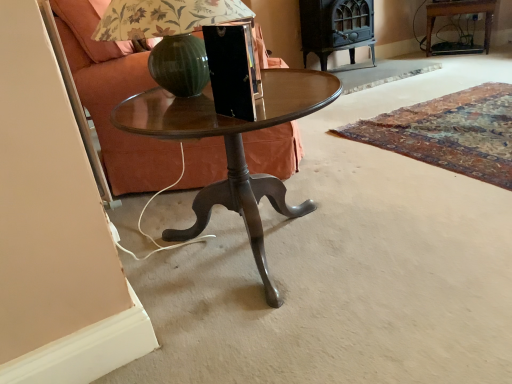
Question: Would you consider wooden side table at upper right to be distant from metallic green glass at center?

Choices:
 (A) no
 (B) yes

Answer: (B)

Question: Is metallic green glass at center at the back of wooden side table at upper right?

Choices:
 (A) no
 (B) yes

Answer: (A)

Question: From a real-world perspective, is wooden side table at upper right under metallic green glass at center?

Choices:
 (A) yes
 (B) no

Answer: (A)

Question: Can you confirm if wooden side table at upper right is shorter than metallic green glass at center?

Choices:
 (A) no
 (B) yes

Answer: (A)

Question: Does wooden side table at upper right lie in front of metallic green glass at center?

Choices:
 (A) yes
 (B) no

Answer: (B)

Question: Would you say metallic green glass at center is part of wooden side table at upper right's contents?

Choices:
 (A) no
 (B) yes

Answer: (A)

Question: Is the surface of wooden glossy table at center in direct contact with metallic green glass at center?

Choices:
 (A) yes
 (B) no

Answer: (B)

Question: Does wooden glossy table at center have a greater width compared to metallic green glass at center?

Choices:
 (A) no
 (B) yes

Answer: (B)

Question: Is wooden glossy table at center at the right side of metallic green glass at center?

Choices:
 (A) yes
 (B) no

Answer: (A)

Question: Can metallic green glass at center be found inside wooden glossy table at center?

Choices:
 (A) yes
 (B) no

Answer: (B)

Question: Can you confirm if wooden glossy table at center is smaller than metallic green glass at center?

Choices:
 (A) no
 (B) yes

Answer: (A)

Question: Is metallic green glass at center at the back of wooden glossy table at center?

Choices:
 (A) no
 (B) yes

Answer: (A)

Question: Is wooden side table at upper right in contact with wooden glossy table at center?

Choices:
 (A) no
 (B) yes

Answer: (A)